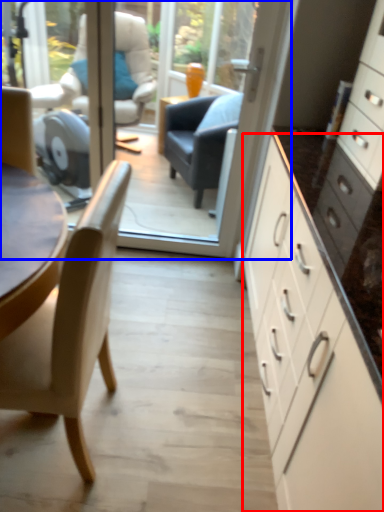
Question: Which point is further to the camera, cabinetry (highlighted by a red box) or glass door (highlighted by a blue box)?

Choices:
 (A) cabinetry
 (B) glass door

Answer: (B)